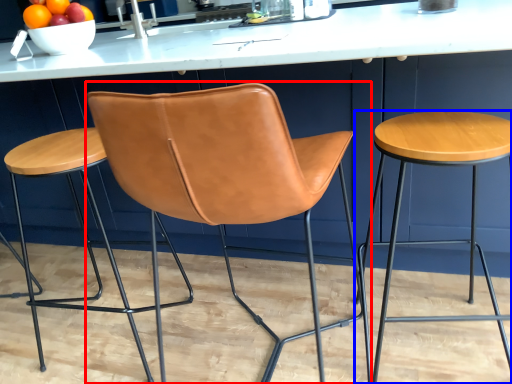
Question: Which point is closer to the camera, chair (highlighted by a red box) or stool (highlighted by a blue box)?

Choices:
 (A) chair
 (B) stool

Answer: (A)